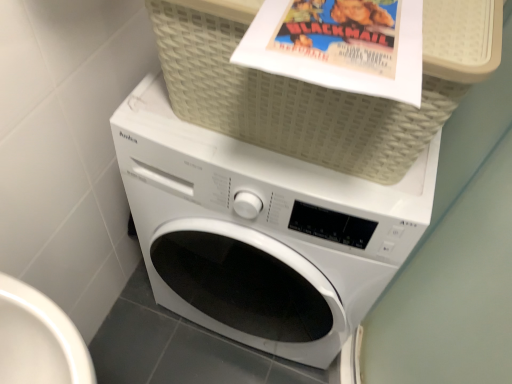
Question: Is beige woven basket at upper center turned away from white matte washing machine at center?

Choices:
 (A) no
 (B) yes

Answer: (A)

Question: Is beige woven basket at upper center not within white matte washing machine at center?

Choices:
 (A) no
 (B) yes

Answer: (B)

Question: Is the depth of beige woven basket at upper center less than that of white matte washing machine at center?

Choices:
 (A) yes
 (B) no

Answer: (A)

Question: Is beige woven basket at upper center next to white matte washing machine at center?

Choices:
 (A) yes
 (B) no

Answer: (B)

Question: Considering the relative sizes of beige woven basket at upper center and white matte washing machine at center in the image provided, is beige woven basket at upper center taller than white matte washing machine at center?

Choices:
 (A) yes
 (B) no

Answer: (B)

Question: From the image's perspective, would you say beige woven basket at upper center is positioned over white matte washing machine at center?

Choices:
 (A) yes
 (B) no

Answer: (A)

Question: Considering the relative sizes of white matte washing machine at center and beige woven basket at upper center in the image provided, is white matte washing machine at center bigger than beige woven basket at upper center?

Choices:
 (A) no
 (B) yes

Answer: (B)

Question: Is white matte washing machine at center aimed at beige woven basket at upper center?

Choices:
 (A) yes
 (B) no

Answer: (B)

Question: Considering the relative sizes of white matte washing machine at center and beige woven basket at upper center in the image provided, is white matte washing machine at center taller than beige woven basket at upper center?

Choices:
 (A) yes
 (B) no

Answer: (A)

Question: Considering the relative sizes of white matte washing machine at center and beige woven basket at upper center in the image provided, is white matte washing machine at center wider than beige woven basket at upper center?

Choices:
 (A) no
 (B) yes

Answer: (B)

Question: From the image's perspective, is white matte washing machine at center on beige woven basket at upper center?

Choices:
 (A) no
 (B) yes

Answer: (A)

Question: Is white matte washing machine at center turned away from beige woven basket at upper center?

Choices:
 (A) no
 (B) yes

Answer: (A)

Question: In terms of height, does beige woven basket at upper center look taller or shorter compared to white matte washing machine at center?

Choices:
 (A) short
 (B) tall

Answer: (A)